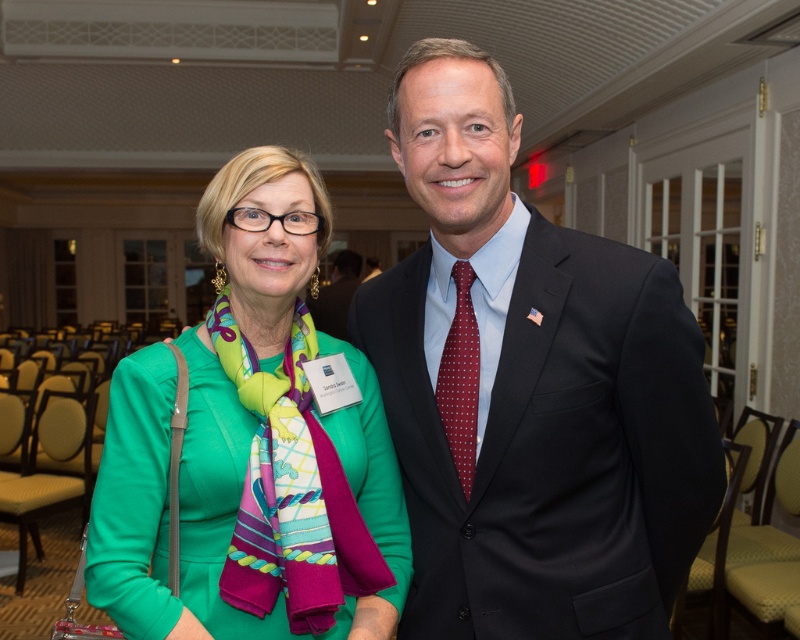
Which of these two, dark blue suit at center or red dotted tie at center, stands shorter?

red dotted tie at center is shorter.

Can you confirm if dark blue suit at center is positioned to the left of red dotted tie at center?

No, dark blue suit at center is not to the left of red dotted tie at center.

The width and height of the screenshot is (800, 640). What do you see at coordinates (530, 388) in the screenshot?
I see `dark blue suit at center` at bounding box center [530, 388].

Find the location of a particular element. dark blue suit at center is located at coordinates (530, 388).

Is dark blue suit at center to the left of green silk scarf at center from the viewer's perspective?

In fact, dark blue suit at center is to the right of green silk scarf at center.

Does dark blue suit at center lie in front of green silk scarf at center?

No, dark blue suit at center is behind green silk scarf at center.

Is point (625, 385) behind point (292, 484)?

Yes.

What are the coordinates of `dark blue suit at center` in the screenshot? It's located at (530, 388).

Can you confirm if green silk scarf at center is taller than dark suit at center?

Yes.

The image size is (800, 640). I want to click on green silk scarf at center, so click(x=245, y=444).

The image size is (800, 640). What are the coordinates of `green silk scarf at center` in the screenshot? It's located at (245, 444).